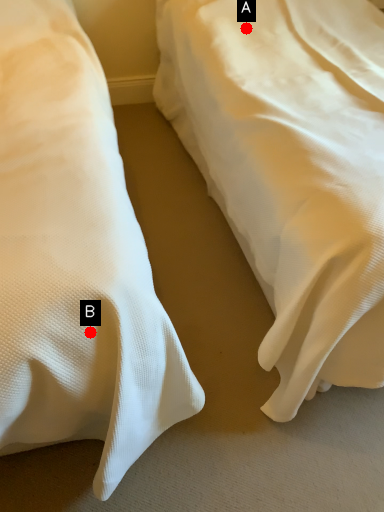
Question: Two points are circled on the image, labeled by A and B beside each circle. Which point appears farthest from the camera in this image?

Choices:
 (A) A is further
 (B) B is further

Answer: (A)